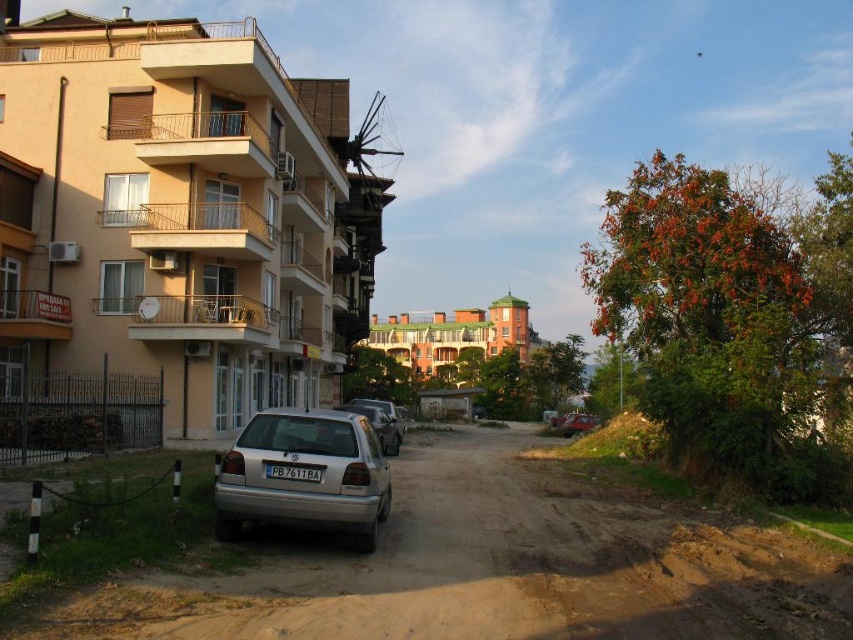
Question: Which object is positioned closest to the silver metallic car at center?

Choices:
 (A) silver metallic hatchback at center
 (B) metallic silver sedan at center
 (C) brown dirt track at lower center

Answer: (C)

Question: Is silver metallic car at center bigger than black plastic license plate at center?

Choices:
 (A) yes
 (B) no

Answer: (A)

Question: Which is nearer to the black plastic license plate at center?

Choices:
 (A) metallic silver sedan at center
 (B) brown dirt track at lower center
 (C) silver metallic hatchback at center

Answer: (C)

Question: Which of these objects is positioned closest to the black plastic license plate at center?

Choices:
 (A) metallic silver sedan at center
 (B) silver metallic hatchback at center
 (C) silver metallic car at center
 (D) brown dirt track at lower center

Answer: (B)

Question: Can you confirm if silver metallic car at center is smaller than metallic silver sedan at center?

Choices:
 (A) no
 (B) yes

Answer: (A)

Question: Is silver metallic car at center to the right of metallic silver sedan at center from the viewer's perspective?

Choices:
 (A) yes
 (B) no

Answer: (B)